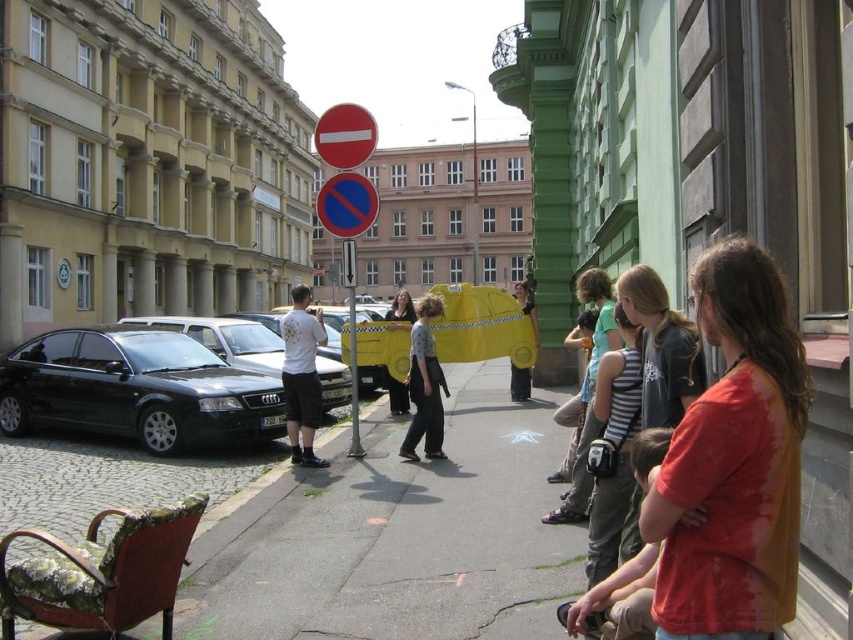
Find the location of `shiny black car at left`. shiny black car at left is located at coordinates (225, 339).

Consider the image. Which is above, shiny black car at left or matte yellow t-shirt at center?

matte yellow t-shirt at center is above.

Who is more distant from viewer, (279, 368) or (521, 396)?

The point (521, 396) is more distant.

Image resolution: width=853 pixels, height=640 pixels. Identify the location of shiny black car at left. (225, 339).

Which is above, white matte t-shirt at center or matte yellow t-shirt at center?

matte yellow t-shirt at center is higher up.

Which is behind, point (293, 408) or point (520, 298)?

Point (520, 298)

Find the location of a particular element. Image resolution: width=853 pixels, height=640 pixels. white matte t-shirt at center is located at coordinates (300, 376).

Looking at this image, is the position of light blue denim jeans at center more distant than that of matte black dress at center?

No, it is in front of matte black dress at center.

Where is `light blue denim jeans at center`? light blue denim jeans at center is located at coordinates (576, 392).

This screenshot has width=853, height=640. What do you see at coordinates (576, 392) in the screenshot?
I see `light blue denim jeans at center` at bounding box center [576, 392].

Where is `light blue denim jeans at center`? Image resolution: width=853 pixels, height=640 pixels. light blue denim jeans at center is located at coordinates (576, 392).